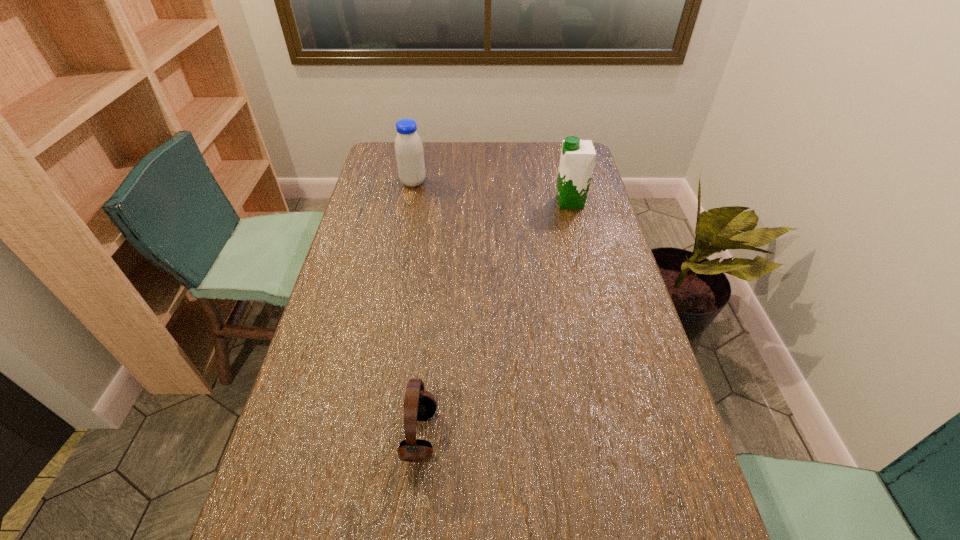
The width and height of the screenshot is (960, 540). In order to click on the rightmost object in this screenshot , I will do `click(577, 159)`.

The width and height of the screenshot is (960, 540). In order to click on the nearer soya milk in this screenshot , I will do tap(577, 159).

You are a GUI agent. You are given a task and a screenshot of the screen. Output one action in this format:
    pyautogui.click(x=<x>, y=<y>)
    Task: Click on the left soya milk
    Image resolution: width=960 pixels, height=540 pixels.
    Given the screenshot: What is the action you would take?
    pyautogui.click(x=409, y=152)

The width and height of the screenshot is (960, 540). Identify the location of the leftmost object. (409, 152).

Where is `the second object from right to left`? The image size is (960, 540). the second object from right to left is located at coordinates (419, 405).

You are a GUI agent. You are given a task and a screenshot of the screen. Output one action in this format:
    pyautogui.click(x=<x>, y=<y>)
    Task: Click on the shortest object
    The image size is (960, 540).
    Given the screenshot: What is the action you would take?
    pyautogui.click(x=419, y=405)

You are a GUI agent. You are given a task and a screenshot of the screen. Output one action in this format:
    pyautogui.click(x=<x>, y=<y>)
    Task: Click on the free space located 0.270m on the front-facing side of the second farthest object
    
    Given the screenshot: What is the action you would take?
    pyautogui.click(x=481, y=202)

Identify the location of free space located 0.360m on the front-facing side of the second farthest object. (457, 202).

Where is `vacant area located 0.190m on the front-facing side of the second farthest object`? This screenshot has width=960, height=540. vacant area located 0.190m on the front-facing side of the second farthest object is located at coordinates (503, 202).

Locate an element on the screen. vacant space located on the back of the farthest object is located at coordinates (418, 157).